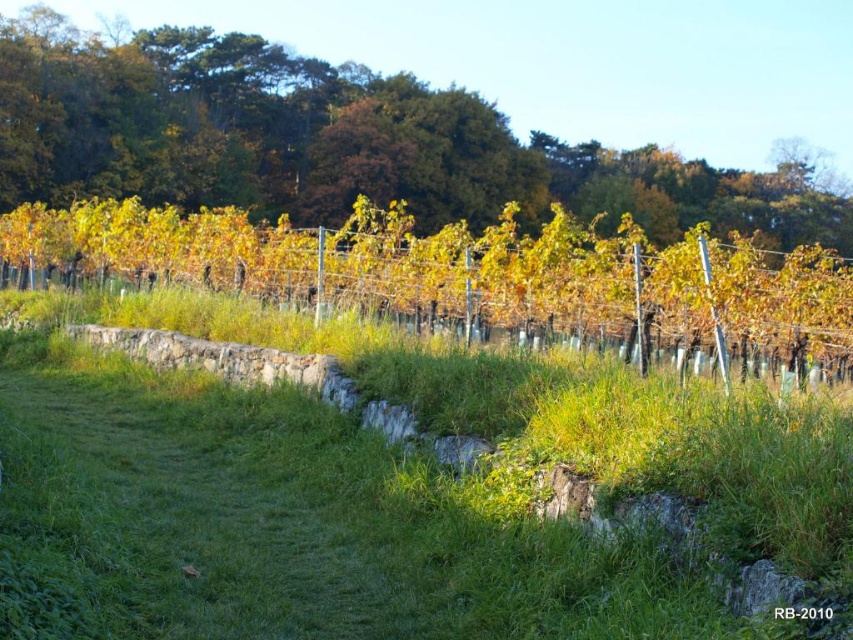
Is point (730, 490) more distant than point (401, 172)?

No, it is in front of (401, 172).

Between point (76, 433) and point (49, 26), which one is positioned in front?

Positioned in front is point (76, 433).

Where is `green grass at center`? The width and height of the screenshot is (853, 640). green grass at center is located at coordinates (386, 486).